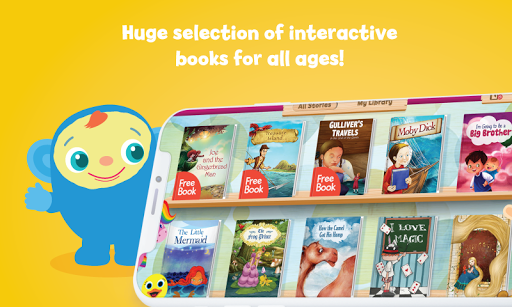
At what (x,y) coordinates should I click in order to perform the action: click on other available books. Please return your answer as a coordinate pair (x, y). Image resolution: width=512 pixels, height=307 pixels. Looking at the image, I should click on (408, 159), (479, 157), (478, 248), (392, 248), (311, 253), (253, 256), (186, 261).